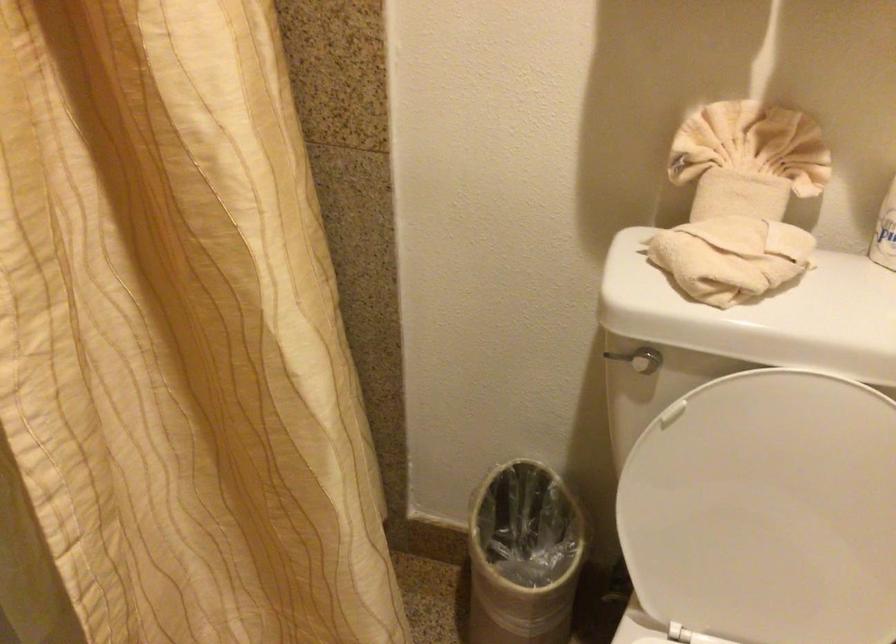
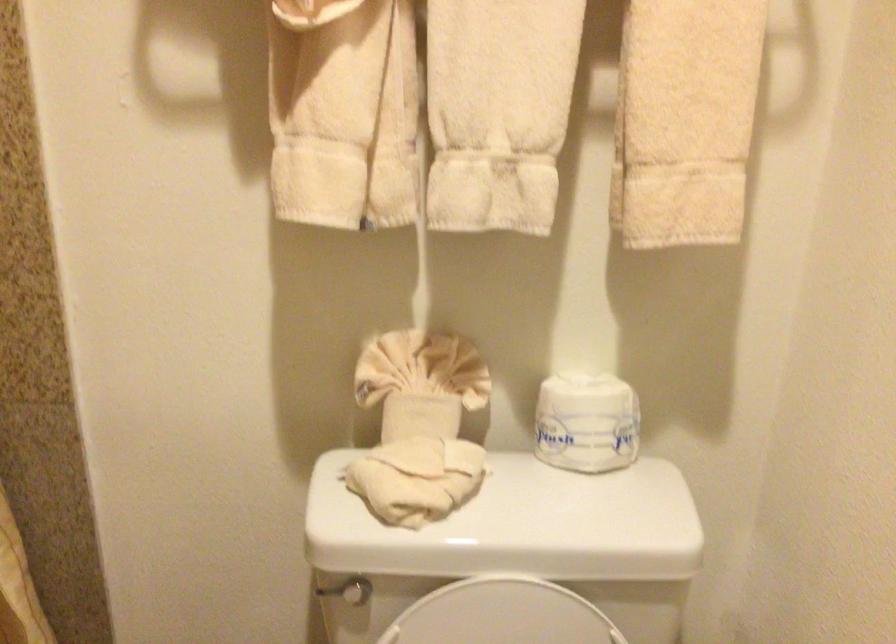
Where in the second image is the point corresponding to (x=612, y=354) from the first image?

(326, 590)